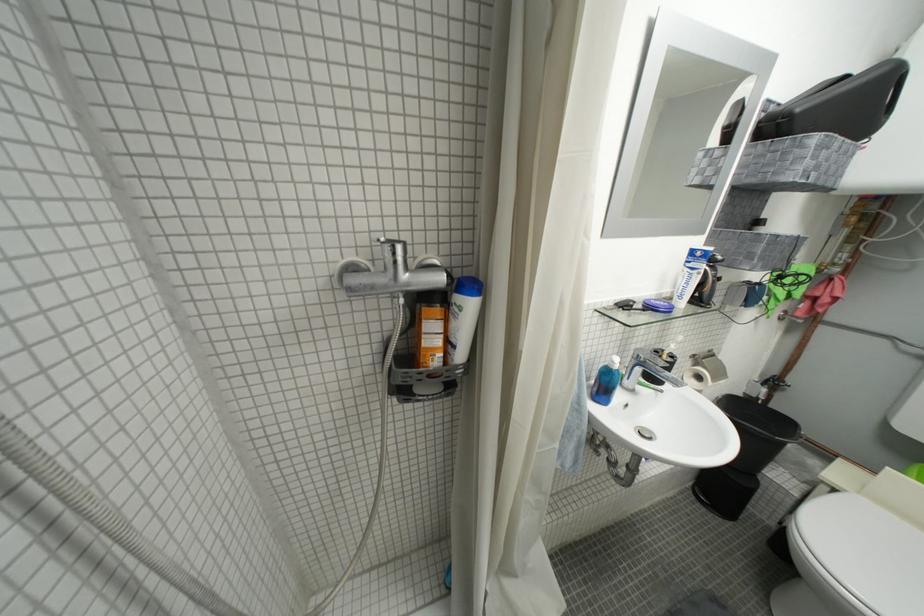
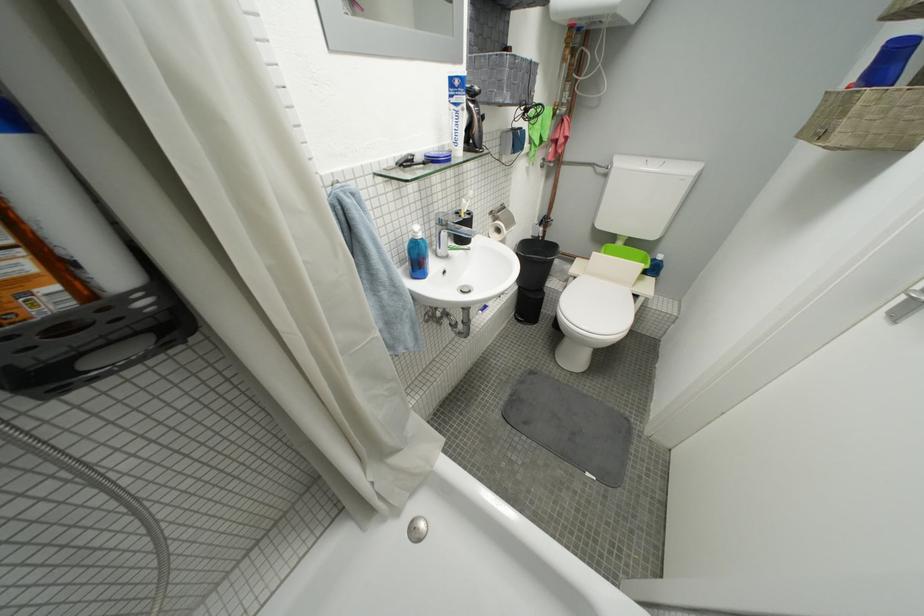
Find the pixel in the second image that matches (x=703, y=358) in the first image.

(500, 214)